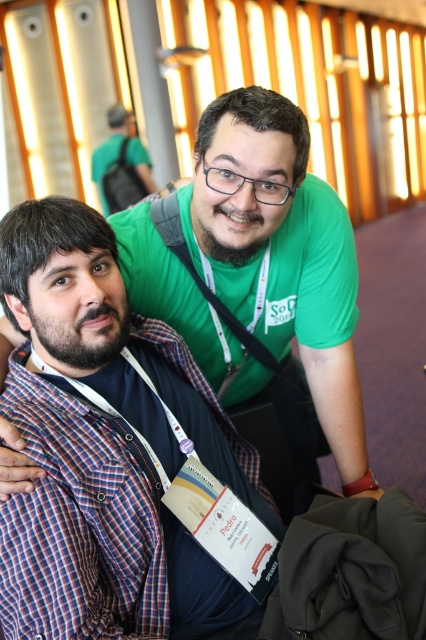
Which of these two, plaid cotton shirt at left or matte green shirt at upper center, stands shorter?

plaid cotton shirt at left

Is the position of plaid cotton shirt at left more distant than that of matte green shirt at upper center?

No, plaid cotton shirt at left is closer to the viewer.

Find the location of a particular element. The width and height of the screenshot is (426, 640). plaid cotton shirt at left is located at coordinates (83, 524).

Who is lower down, green matte shirt at upper center or plaid cotton shirt at left?

plaid cotton shirt at left is lower down.

Which is above, green matte shirt at upper center or plaid cotton shirt at left?

Positioned higher is green matte shirt at upper center.

Does point (302, 314) come behind point (28, 344)?

Yes, it is behind point (28, 344).

In order to click on green matte shirt at upper center in this screenshot , I will do `click(281, 256)`.

Does green matte shirt at upper center lie in front of matte green shirt at upper center?

That is True.

Does green matte shirt at upper center appear under matte green shirt at upper center?

Yes.

Is point (278, 209) farther from viewer compared to point (92, 157)?

No, it is in front of (92, 157).

Find the location of `green matte shirt at upper center`. green matte shirt at upper center is located at coordinates (281, 256).